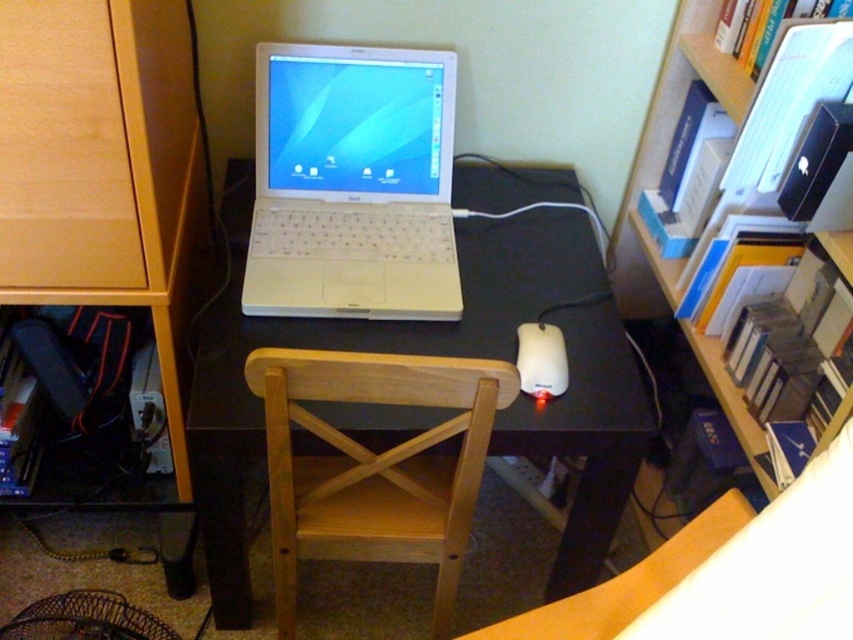
Who is more distant from viewer, (334, 186) or (552, 346)?

The point (334, 186) is more distant.

Which is in front, point (386, 312) or point (553, 387)?

Point (553, 387)

The height and width of the screenshot is (640, 853). Identify the location of white plastic laptop at center. (352, 184).

Is light wood chair at center in front of wooden bookshelf at upper right?

Yes, it is in front of wooden bookshelf at upper right.

Does light wood chair at center appear on the left side of wooden bookshelf at upper right?

Correct, you'll find light wood chair at center to the left of wooden bookshelf at upper right.

This screenshot has height=640, width=853. What do you see at coordinates (374, 465) in the screenshot?
I see `light wood chair at center` at bounding box center [374, 465].

Identify the location of light wood chair at center. (374, 465).

How distant is white plastic laptop at center from matte wood drawer at left?

white plastic laptop at center is 14.28 inches from matte wood drawer at left.

In the scene shown: Is white plastic laptop at center positioned behind matte wood drawer at left?

Yes, it is behind matte wood drawer at left.

The height and width of the screenshot is (640, 853). Find the location of `white plastic laptop at center`. white plastic laptop at center is located at coordinates (352, 184).

At what (x,y) coordinates should I click in order to perform the action: click on white plastic laptop at center. Please return your answer as a coordinate pair (x, y). This screenshot has height=640, width=853. Looking at the image, I should click on (352, 184).